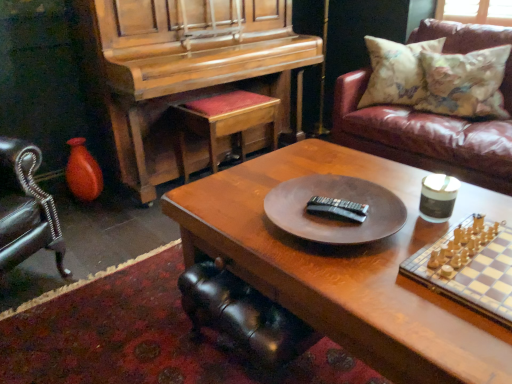
Question: Does floral fabric pillow at upper right, arranged as the first pillow when viewed from the right, have a greater height compared to leather couch at upper right?

Choices:
 (A) no
 (B) yes

Answer: (A)

Question: Is the position of floral fabric pillow at upper right, marked as the second pillow in a left-to-right arrangement, less distant than that of leather couch at upper right?

Choices:
 (A) no
 (B) yes

Answer: (A)

Question: From the image's perspective, does floral fabric pillow at upper right, arranged as the first pillow when viewed from the right, appear lower than leather couch at upper right?

Choices:
 (A) no
 (B) yes

Answer: (A)

Question: Would you say leather couch at upper right is part of floral fabric pillow at upper right, arranged as the first pillow when viewed from the right,'s contents?

Choices:
 (A) yes
 (B) no

Answer: (B)

Question: Is floral fabric pillow at upper right, marked as the second pillow in a left-to-right arrangement, positioned beyond the bounds of leather couch at upper right?

Choices:
 (A) no
 (B) yes

Answer: (A)

Question: Visually, is floral fabric pillow at upper right, positioned as the 1th pillow in left-to-right order, positioned to the left or to the right of wooden cushioned stool at center?

Choices:
 (A) left
 (B) right

Answer: (B)

Question: Considering their positions, is floral fabric pillow at upper right, positioned as the 2th pillow in right-to-left order, located in front of or behind wooden cushioned stool at center?

Choices:
 (A) behind
 (B) front

Answer: (A)

Question: From the image's perspective, is floral fabric pillow at upper right, positioned as the 1th pillow in left-to-right order, above or below wooden cushioned stool at center?

Choices:
 (A) below
 (B) above

Answer: (B)

Question: Considering the positions of floral fabric pillow at upper right, positioned as the 2th pillow in right-to-left order, and wooden cushioned stool at center in the image, is floral fabric pillow at upper right, positioned as the 2th pillow in right-to-left order, bigger or smaller than wooden cushioned stool at center?

Choices:
 (A) big
 (B) small

Answer: (B)

Question: Considering the positions of polished wood piano at left and wooden cushioned stool at center in the image, is polished wood piano at left wider or thinner than wooden cushioned stool at center?

Choices:
 (A) thin
 (B) wide

Answer: (B)

Question: Do you think polished wood piano at left is within wooden cushioned stool at center, or outside of it?

Choices:
 (A) outside
 (B) inside

Answer: (A)

Question: Is polished wood piano at left bigger or smaller than wooden cushioned stool at center?

Choices:
 (A) small
 (B) big

Answer: (B)

Question: From a real-world perspective, is polished wood piano at left positioned above or below wooden cushioned stool at center?

Choices:
 (A) below
 (B) above

Answer: (B)

Question: Is point (266, 107) positioned closer to the camera than point (234, 218)?

Choices:
 (A) closer
 (B) farther

Answer: (B)

Question: In the image, is polished wood piano at left positioned in front of or behind wooden coffee table at center?

Choices:
 (A) behind
 (B) front

Answer: (A)